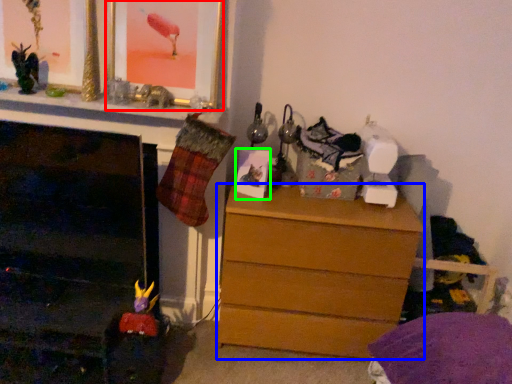
Question: Considering the real-world distances, which object is closest to picture frame (highlighted by a red box)? chest of drawers (highlighted by a blue box) or picture frame (highlighted by a green box).

Choices:
 (A) chest of drawers
 (B) picture frame

Answer: (B)